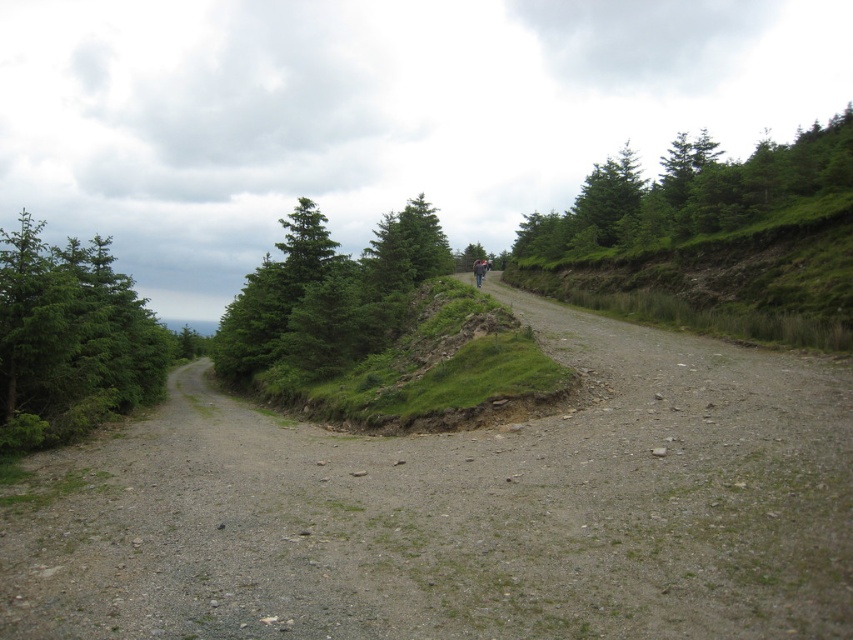
You are a hiker planning to walk along the gravel path. You notice the green leafy trees at upper right and the green leafy trees at center. Which group of trees is taller?

The green leafy trees at upper right are taller than the green leafy trees at center.

You are a hiker standing at the start of the path. You want to walk towards the two figures in the distance. Which object will you encounter first, the dull gray gravel road at left or the green leafy trees at upper right?

The dull gray gravel road at left is in front of the green leafy trees at upper right, so you will encounter the dull gray gravel road at left first.

In the scene shown: You are a hiker trying to follow the path. You see the dull gray gravel road at left and the green leafy trees at upper right. Which direction should you go to stay on the path?

The dull gray gravel road at left is positioned on the left side of green leafy trees at upper right, so to stay on the path, you should head towards the dull gray gravel road at left.